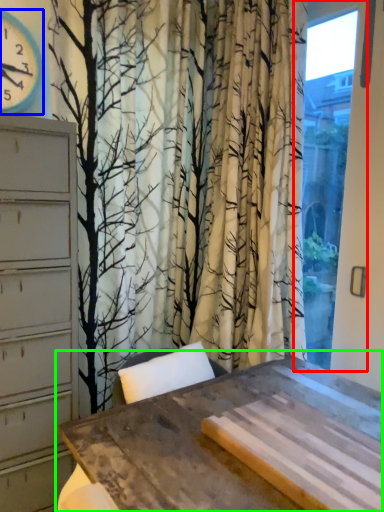
Question: Which is farther away from window (highlighted by a red box)? clock (highlighted by a blue box) or table (highlighted by a green box)?

Choices:
 (A) clock
 (B) table

Answer: (A)